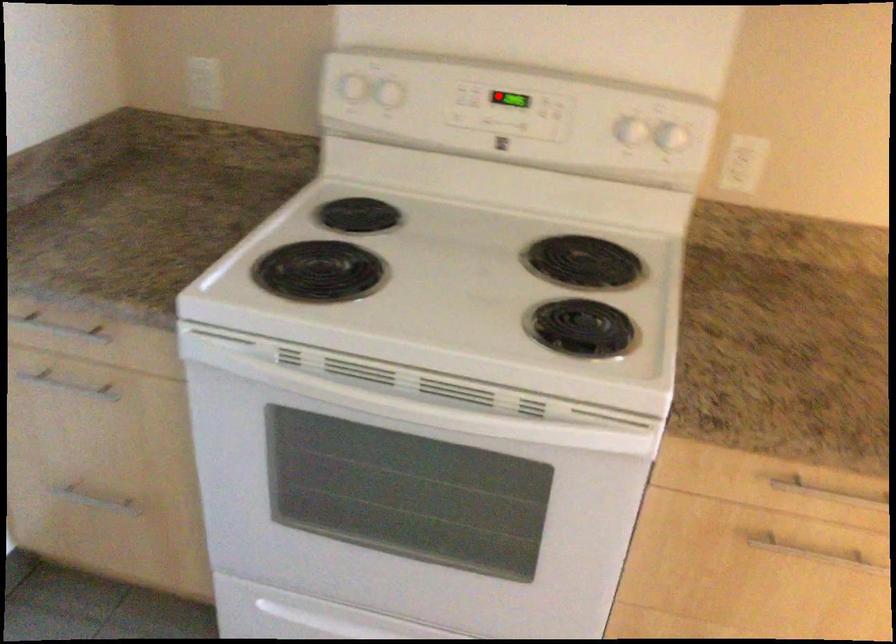
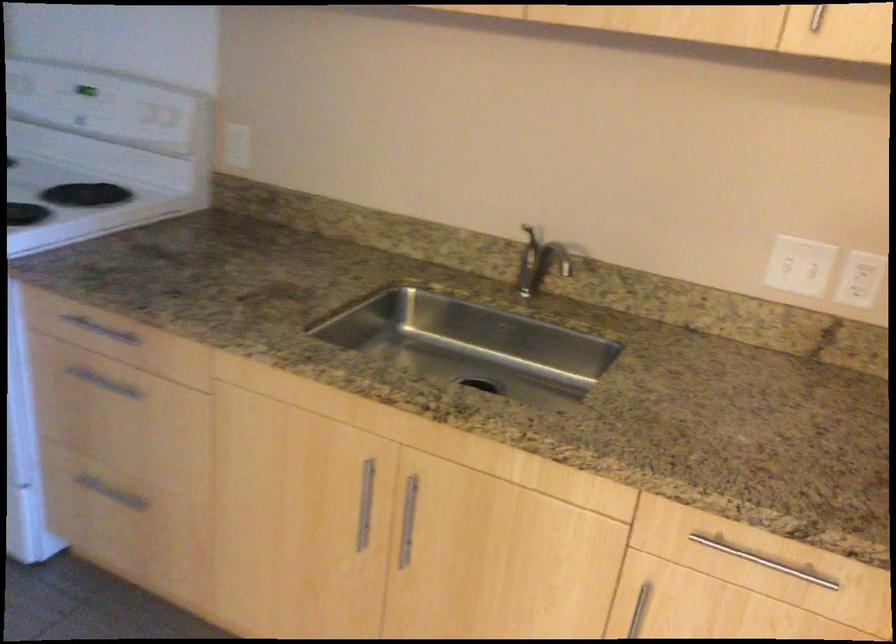
Find the pixel in the second image that matches the highlighted location in the first image.

(85, 90)